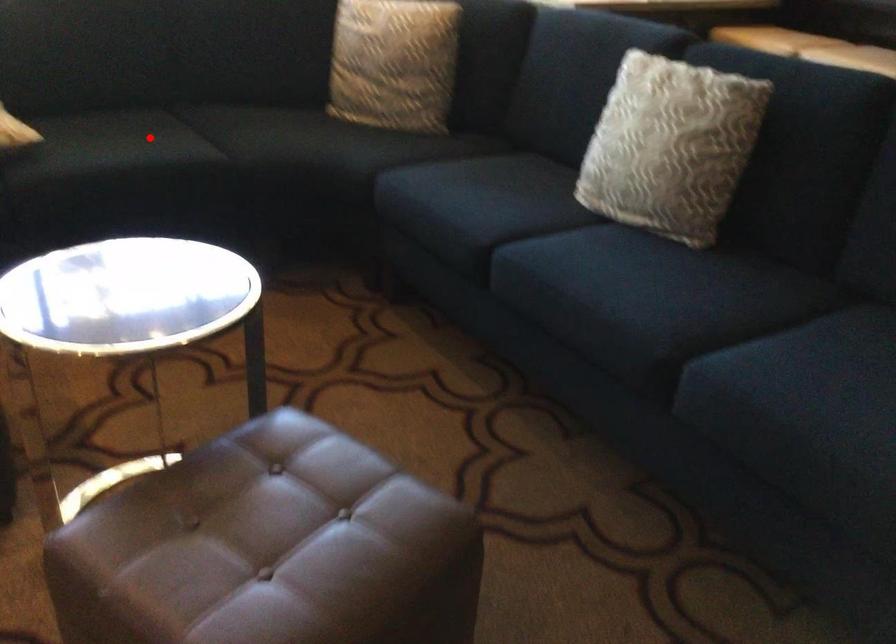
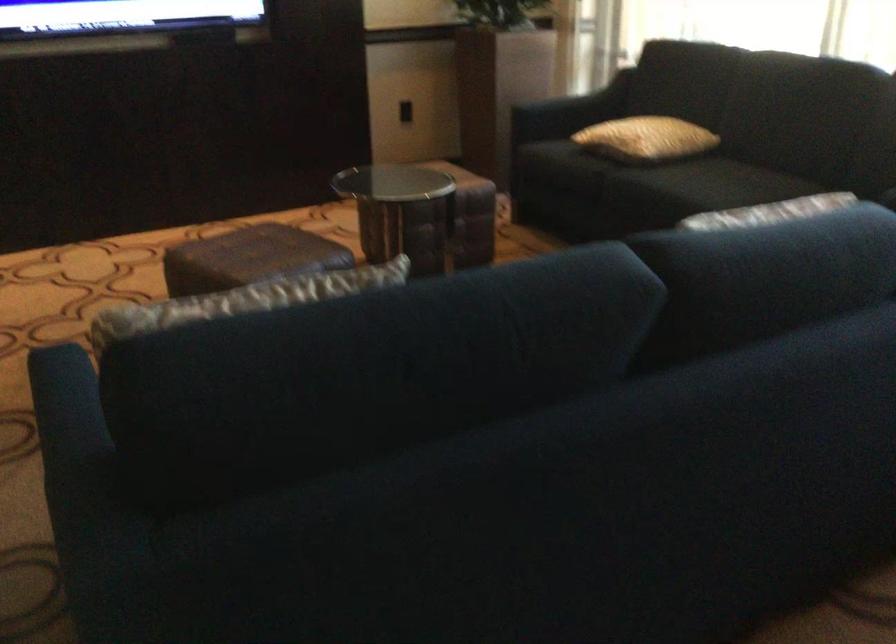
Question: I am providing you with two images of the same scene from different viewpoints. Given a red point in image1, look at the same physical point in image2. Is it:

Choices:
 (A) Closer to the viewpoint
 (B) Farther from the viewpoint

Answer: (B)